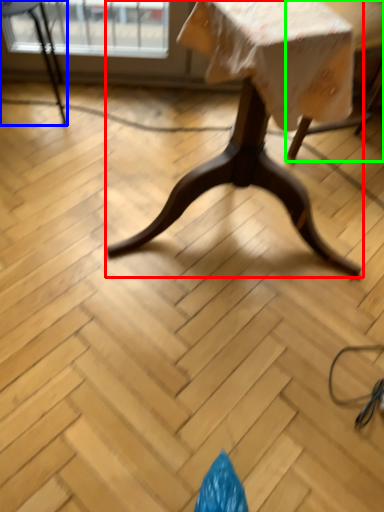
Question: Which object is the closest to the table (highlighted by a red box)? Choose among these: chair (highlighted by a blue box) or swivel chair (highlighted by a green box).

Choices:
 (A) chair
 (B) swivel chair

Answer: (B)